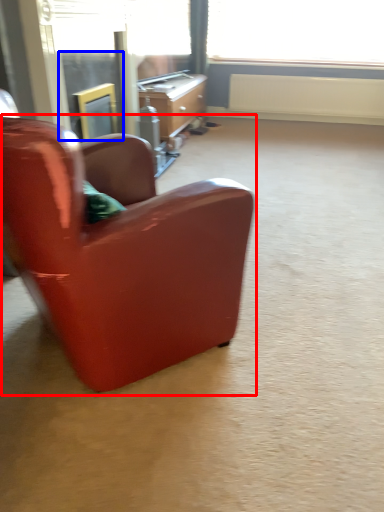
Question: Which object is further to the camera taking this photo, chair (highlighted by a red box) or screen door (highlighted by a blue box)?

Choices:
 (A) chair
 (B) screen door

Answer: (B)